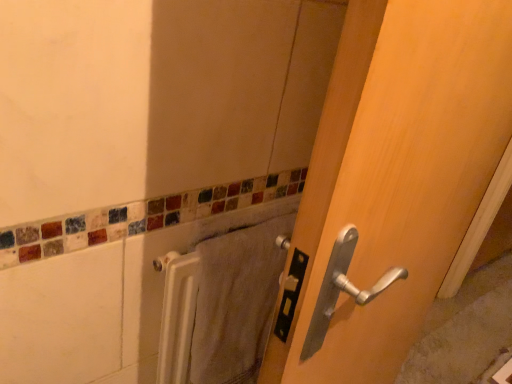
Question: Is wooden door at center completely or partially outside of white textured towel at lower center?

Choices:
 (A) no
 (B) yes

Answer: (B)

Question: Is wooden door at center oriented away from white textured towel at lower center?

Choices:
 (A) yes
 (B) no

Answer: (A)

Question: Does wooden door at center have a lesser width compared to white textured towel at lower center?

Choices:
 (A) yes
 (B) no

Answer: (B)

Question: Does wooden door at center have a greater height compared to white textured towel at lower center?

Choices:
 (A) no
 (B) yes

Answer: (B)

Question: From a real-world perspective, is wooden door at center physically above white textured towel at lower center?

Choices:
 (A) no
 (B) yes

Answer: (B)

Question: From a real-world perspective, is wooden door at center below white textured towel at lower center?

Choices:
 (A) no
 (B) yes

Answer: (A)

Question: Is white textured towel at lower center oriented away from wooden door at center?

Choices:
 (A) yes
 (B) no

Answer: (B)

Question: Is white textured towel at lower center not within wooden door at center?

Choices:
 (A) no
 (B) yes

Answer: (B)

Question: Can you confirm if white textured towel at lower center is positioned to the right of wooden door at center?

Choices:
 (A) yes
 (B) no

Answer: (B)

Question: Does white textured towel at lower center touch wooden door at center?

Choices:
 (A) no
 (B) yes

Answer: (A)

Question: Is white textured towel at lower center far from wooden door at center?

Choices:
 (A) no
 (B) yes

Answer: (A)

Question: Is the position of white textured towel at lower center less distant than that of wooden door at center?

Choices:
 (A) yes
 (B) no

Answer: (B)

Question: In the image, is white textured towel at lower center positioned in front of or behind wooden door at center?

Choices:
 (A) behind
 (B) front

Answer: (A)